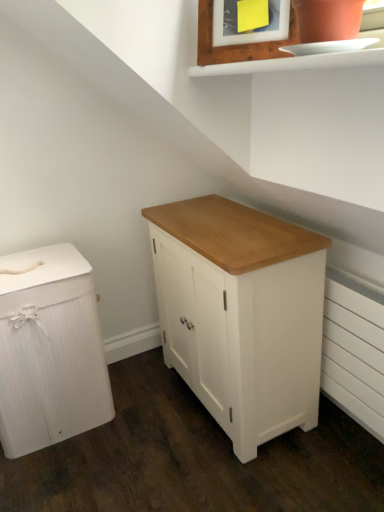
Where is `free space to the left of white painted wood cabinet at center, the first chest of drawers viewed from the right`? free space to the left of white painted wood cabinet at center, the first chest of drawers viewed from the right is located at coordinates (133, 420).